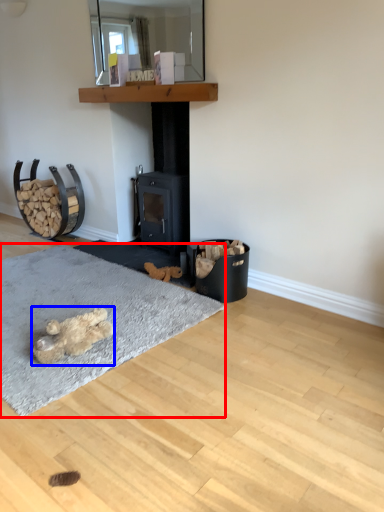
Question: Which of the following is the farthest to the observer, mat (highlighted by a red box) or animal (highlighted by a blue box)?

Choices:
 (A) mat
 (B) animal

Answer: (B)